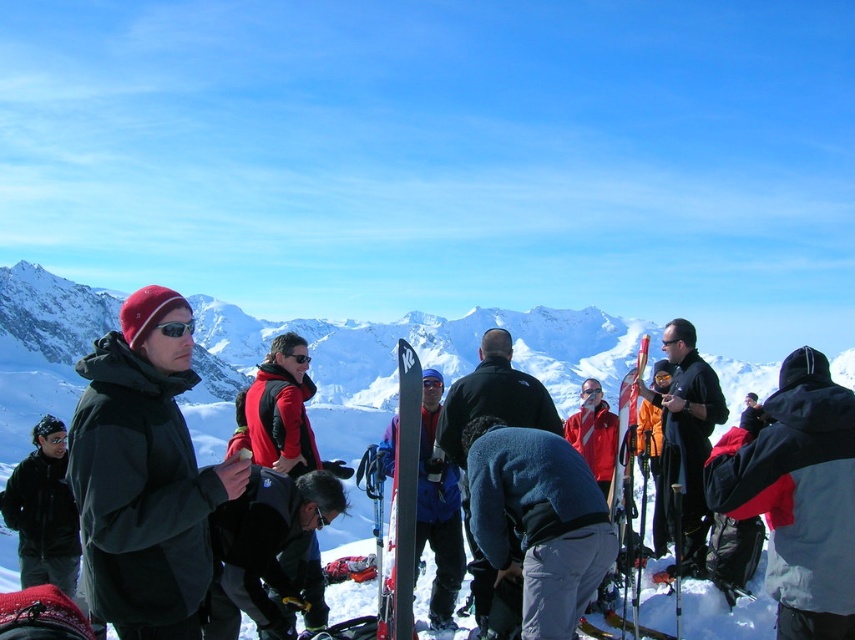
You are a photographer standing at the camera position and want to capture a closeup shot of the matte black ski at center. Considering the distance, will you need a telephoto lens to focus on it?

The matte black ski at center is 198.87 feet away from camera, so yes, you will need a telephoto lens to focus on it from that distance.

You are a photographer standing at the edge of the snowy slope. You want to take a photo that includes both the red jacket at center and the matte black ski at center. Which object will appear smaller in the photo?

The red jacket at center will appear smaller in the photo because it is shorter than the matte black ski at center.

Looking at this image, you are a photographer planning to take a photo of the red jacket at center and the matte black ski at center. Which object should you focus on first if you want to capture both in focus without adjusting the camera settings? Please explain your reasoning based on their positions.

The red jacket at center is above the matte black ski at center. To capture both in focus without adjusting the camera settings, you should focus on the matte black ski at center first because it is closer to the camera. This ensures that the foreground object is sharp, and the background object may still be within the depth of field.